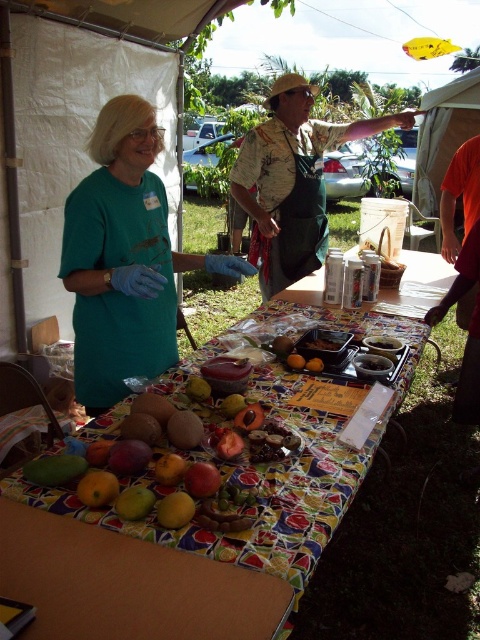
You are standing at the front of the table and want to pick up the yellow matte mango at center. Is the teal fabric shirt at upper left blocking your direct path to it?

The teal fabric shirt at upper left is further to the viewer than the yellow matte mango at center, so it is closer to you and blocking your direct path to the yellow matte mango at center.

You are a participant at this event and want to grab the yellow matte mango at center. However, there is a teal fabric shirt at upper left blocking your path. Can you reach the mango without moving the shirt?

The teal fabric shirt at upper left is to the left of yellow matte mango at center, so you can reach the mango by moving around to the right side of the shirt.

You are organizing a fruit display at the event and need to place the hawaiian shirt at center and the green matte mango at center on the table. Which item takes up more space on the table?

The hawaiian shirt at center is bigger than the green matte mango at center, so it takes up more space on the table.